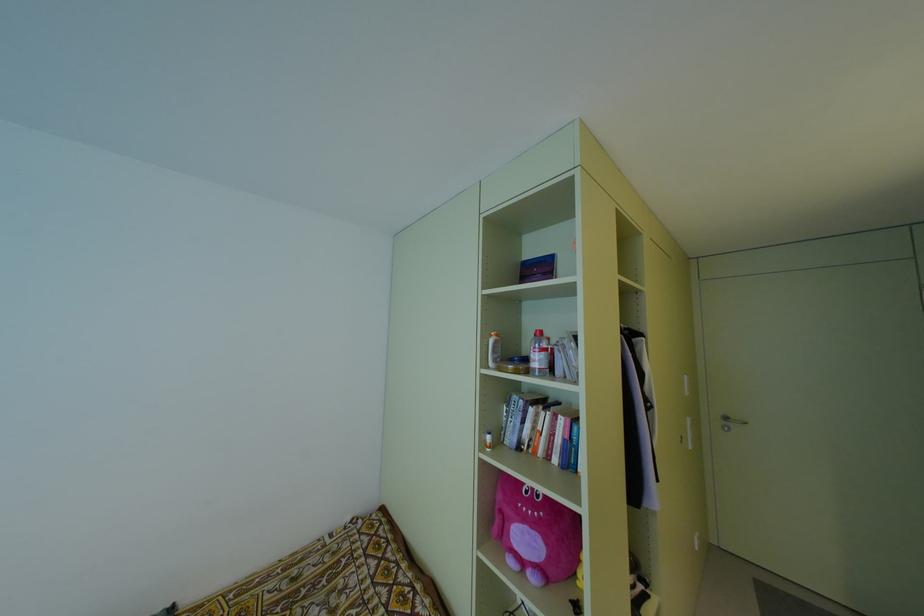
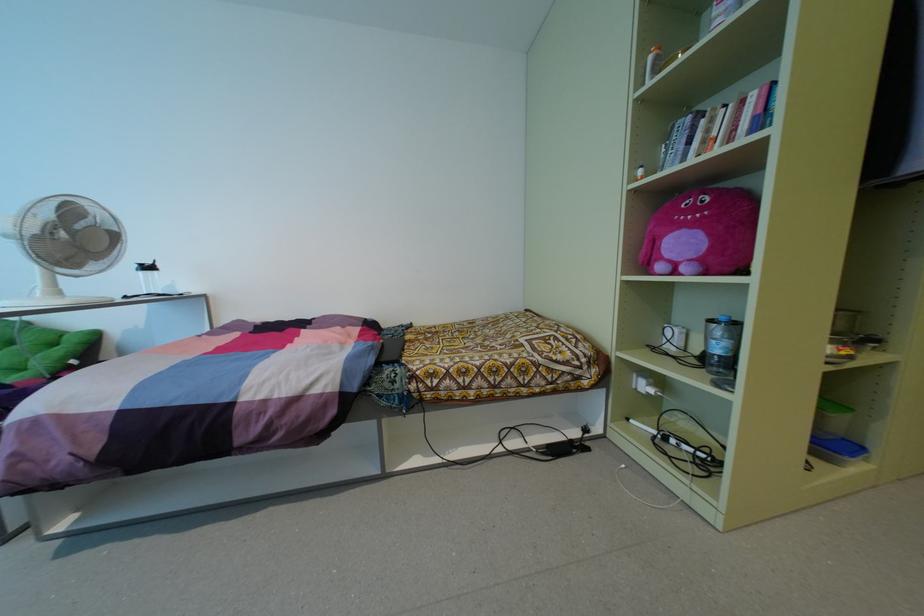
Locate, in the second image, the point that corresponds to point (552, 435) in the first image.

(734, 129)